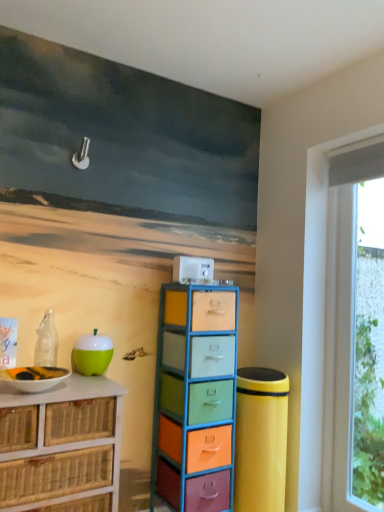
This screenshot has height=512, width=384. What do you see at coordinates (61, 446) in the screenshot?
I see `white wicker chest of drawers at left, the second chest of drawers viewed from the right` at bounding box center [61, 446].

What do you see at coordinates (34, 378) in the screenshot? This screenshot has width=384, height=512. I see `white glossy bowl at lower left` at bounding box center [34, 378].

Identify the location of multicolored plastic drawers at center, arranged as the 2th chest of drawers when viewed from the left. The image size is (384, 512). (195, 398).

This screenshot has width=384, height=512. I want to click on transparent glass window at right, so click(x=354, y=330).

This screenshot has width=384, height=512. In order to click on white wicker chest of drawers at left, the first chest of drawers from the left in this screenshot , I will do `click(61, 446)`.

Who is smaller, white glossy bowl at lower left or transparent glass window at right?

white glossy bowl at lower left is smaller.

Is white glossy bowl at lower left shorter than transparent glass window at right?

Correct, white glossy bowl at lower left is not as tall as transparent glass window at right.

In the image, is white glossy bowl at lower left positioned in front of or behind transparent glass window at right?

In the image, white glossy bowl at lower left appears in front of transparent glass window at right.

Measure the distance from white glossy bowl at lower left to transparent glass window at right.

white glossy bowl at lower left is 5.25 feet away from transparent glass window at right.

Who is shorter, transparent glass window at right or multicolored plastic drawers at center, arranged as the 2th chest of drawers when viewed from the left?

multicolored plastic drawers at center, arranged as the 2th chest of drawers when viewed from the left, is shorter.

Is point (355, 447) closer to camera compared to point (225, 412)?

No, it is not.

Is transparent glass window at right not close to multicolored plastic drawers at center, which appears as the 1th chest of drawers when viewed from the right?

Actually, transparent glass window at right and multicolored plastic drawers at center, which appears as the 1th chest of drawers when viewed from the right, are a little close together.

Can you tell me how much transparent glass window at right and multicolored plastic drawers at center, which appears as the 1th chest of drawers when viewed from the right, differ in facing direction?

The angle between the facing direction of transparent glass window at right and the facing direction of multicolored plastic drawers at center, which appears as the 1th chest of drawers when viewed from the right, is 89.6 degrees.

From a real-world perspective, is white wicker chest of drawers at left, the first chest of drawers from the left, positioned above or below multicolored plastic drawers at center, which appears as the 1th chest of drawers when viewed from the right?

white wicker chest of drawers at left, the first chest of drawers from the left, is situated lower than multicolored plastic drawers at center, which appears as the 1th chest of drawers when viewed from the right, in the real world.

From the image's perspective, between white wicker chest of drawers at left, the first chest of drawers from the left, and multicolored plastic drawers at center, which appears as the 1th chest of drawers when viewed from the right, who is located below?

white wicker chest of drawers at left, the first chest of drawers from the left, is shown below in the image.

Is white wicker chest of drawers at left, the second chest of drawers viewed from the right, next to multicolored plastic drawers at center, arranged as the 2th chest of drawers when viewed from the left?

They are not placed beside each other.

I want to click on the chest of drawers that is under the multicolored plastic drawers at center, arranged as the 2th chest of drawers when viewed from the left (from a real-world perspective), so click(61, 446).

Would you say white glossy bowl at lower left is inside or outside multicolored plastic drawers at center, arranged as the 2th chest of drawers when viewed from the left?

white glossy bowl at lower left is located beyond the bounds of multicolored plastic drawers at center, arranged as the 2th chest of drawers when viewed from the left.

From the image's perspective, is white glossy bowl at lower left above multicolored plastic drawers at center, which appears as the 1th chest of drawers when viewed from the right?

Yes, from the image's perspective, white glossy bowl at lower left is above multicolored plastic drawers at center, which appears as the 1th chest of drawers when viewed from the right.

Is white glossy bowl at lower left not near multicolored plastic drawers at center, arranged as the 2th chest of drawers when viewed from the left?

They are positioned close to each other.

This screenshot has width=384, height=512. I want to click on bowl above the multicolored plastic drawers at center, which appears as the 1th chest of drawers when viewed from the right (from the image's perspective), so click(34, 378).

Can we say white wicker chest of drawers at left, the first chest of drawers from the left, lies outside transparent glass window at right?

white wicker chest of drawers at left, the first chest of drawers from the left, lies outside transparent glass window at right's area.

Between white wicker chest of drawers at left, the first chest of drawers from the left, and transparent glass window at right, which one has smaller size?

transparent glass window at right is smaller.

Where is `window that is on the right side of white wicker chest of drawers at left, the first chest of drawers from the left`? The image size is (384, 512). window that is on the right side of white wicker chest of drawers at left, the first chest of drawers from the left is located at coordinates (354, 330).

From a real-world perspective, is multicolored plastic drawers at center, which appears as the 1th chest of drawers when viewed from the right, positioned over white wicker chest of drawers at left, the first chest of drawers from the left, based on gravity?

Yes, from a real-world perspective, multicolored plastic drawers at center, which appears as the 1th chest of drawers when viewed from the right, is on top of white wicker chest of drawers at left, the first chest of drawers from the left.

Who is smaller, multicolored plastic drawers at center, which appears as the 1th chest of drawers when viewed from the right, or white wicker chest of drawers at left, the first chest of drawers from the left?

multicolored plastic drawers at center, which appears as the 1th chest of drawers when viewed from the right, is smaller.

You are a GUI agent. You are given a task and a screenshot of the screen. Output one action in this format:
    pyautogui.click(x=<x>, y=<y>)
    Task: Click on the chest of drawers that is below the multicolored plastic drawers at center, arranged as the 2th chest of drawers when viewed from the left (from the image's perspective)
    Image resolution: width=384 pixels, height=512 pixels.
    Given the screenshot: What is the action you would take?
    pyautogui.click(x=61, y=446)

From the picture: Relative to white wicker chest of drawers at left, the second chest of drawers viewed from the right, is multicolored plastic drawers at center, arranged as the 2th chest of drawers when viewed from the left, in front or behind?

multicolored plastic drawers at center, arranged as the 2th chest of drawers when viewed from the left, is positioned farther from the viewer than white wicker chest of drawers at left, the second chest of drawers viewed from the right.

From a real-world perspective, is white wicker chest of drawers at left, the second chest of drawers viewed from the right, below white glossy bowl at lower left?

Yes.

Considering the sizes of objects white wicker chest of drawers at left, the first chest of drawers from the left, and white glossy bowl at lower left in the image provided, who is thinner, white wicker chest of drawers at left, the first chest of drawers from the left, or white glossy bowl at lower left?

With smaller width is white glossy bowl at lower left.

From the image's perspective, which object appears higher, white wicker chest of drawers at left, the first chest of drawers from the left, or white glossy bowl at lower left?

From the image's view, white glossy bowl at lower left is above.

Which is more to the right, white wicker chest of drawers at left, the second chest of drawers viewed from the right, or white glossy bowl at lower left?

From the viewer's perspective, white wicker chest of drawers at left, the second chest of drawers viewed from the right, appears more on the right side.

This screenshot has width=384, height=512. I want to click on bowl on the left of transparent glass window at right, so click(34, 378).

This screenshot has width=384, height=512. There is a multicolored plastic drawers at center, arranged as the 2th chest of drawers when viewed from the left. What are the coordinates of `window above it (from a real-world perspective)` in the screenshot? It's located at (354, 330).

Based on their spatial positions, is white wicker chest of drawers at left, the second chest of drawers viewed from the right, or multicolored plastic drawers at center, arranged as the 2th chest of drawers when viewed from the left, further from white glossy bowl at lower left?

Based on the image, multicolored plastic drawers at center, arranged as the 2th chest of drawers when viewed from the left, appears to be further to white glossy bowl at lower left.

Based on their spatial positions, is white wicker chest of drawers at left, the first chest of drawers from the left, or transparent glass window at right further from white glossy bowl at lower left?

transparent glass window at right is further to white glossy bowl at lower left.

Based on the photo, which object lies further to the anchor point multicolored plastic drawers at center, which appears as the 1th chest of drawers when viewed from the right, transparent glass window at right or white glossy bowl at lower left?

Based on the image, transparent glass window at right appears to be further to multicolored plastic drawers at center, which appears as the 1th chest of drawers when viewed from the right.

Estimate the real-world distances between objects in this image. Which object is closer to transparent glass window at right, white wicker chest of drawers at left, the first chest of drawers from the left, or multicolored plastic drawers at center, arranged as the 2th chest of drawers when viewed from the left?

multicolored plastic drawers at center, arranged as the 2th chest of drawers when viewed from the left.

Which object lies further to the anchor point multicolored plastic drawers at center, which appears as the 1th chest of drawers when viewed from the right, white glossy bowl at lower left or transparent glass window at right?

Among the two, transparent glass window at right is located further to multicolored plastic drawers at center, which appears as the 1th chest of drawers when viewed from the right.

Which object lies further to the anchor point white glossy bowl at lower left, multicolored plastic drawers at center, which appears as the 1th chest of drawers when viewed from the right, or white wicker chest of drawers at left, the first chest of drawers from the left?

multicolored plastic drawers at center, which appears as the 1th chest of drawers when viewed from the right, is further to white glossy bowl at lower left.

Based on the photo, estimate the real-world distances between objects in this image. Which object is closer to white wicker chest of drawers at left, the first chest of drawers from the left, transparent glass window at right or white glossy bowl at lower left?

white glossy bowl at lower left is positioned closer to the anchor white wicker chest of drawers at left, the first chest of drawers from the left.

Estimate the real-world distances between objects in this image. Which object is further from white glossy bowl at lower left, transparent glass window at right or multicolored plastic drawers at center, arranged as the 2th chest of drawers when viewed from the left?

The object further to white glossy bowl at lower left is transparent glass window at right.

Where is `chest of drawers between white wicker chest of drawers at left, the first chest of drawers from the left, and transparent glass window at right, in the horizontal direction`? The image size is (384, 512). chest of drawers between white wicker chest of drawers at left, the first chest of drawers from the left, and transparent glass window at right, in the horizontal direction is located at coordinates (195, 398).

Find the location of a particular element. Image resolution: width=384 pixels, height=512 pixels. chest of drawers between white glossy bowl at lower left and multicolored plastic drawers at center, which appears as the 1th chest of drawers when viewed from the right is located at coordinates (61, 446).